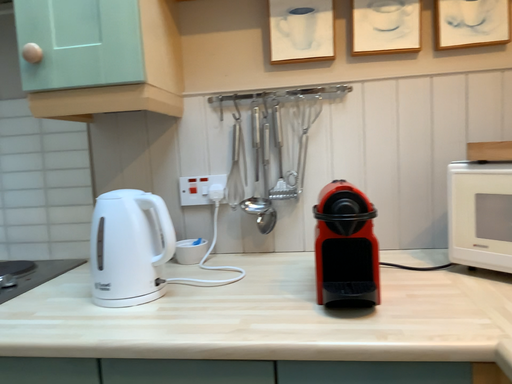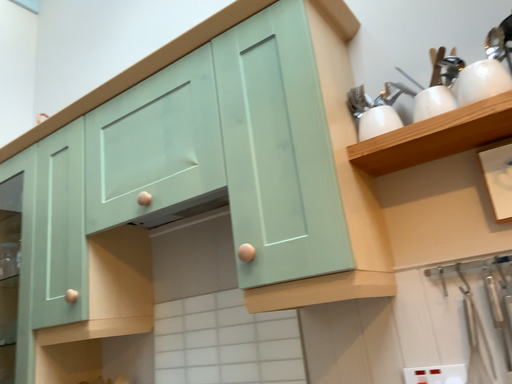
Question: How did the camera likely rotate when shooting the video?

Choices:
 (A) rotated left
 (B) rotated right

Answer: (A)